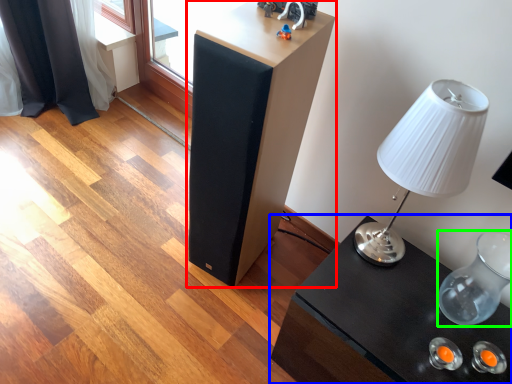
Question: Which is farther away from furniture (highlighted by a red box)? table (highlighted by a blue box) or glass vase (highlighted by a green box)?

Choices:
 (A) table
 (B) glass vase

Answer: (B)